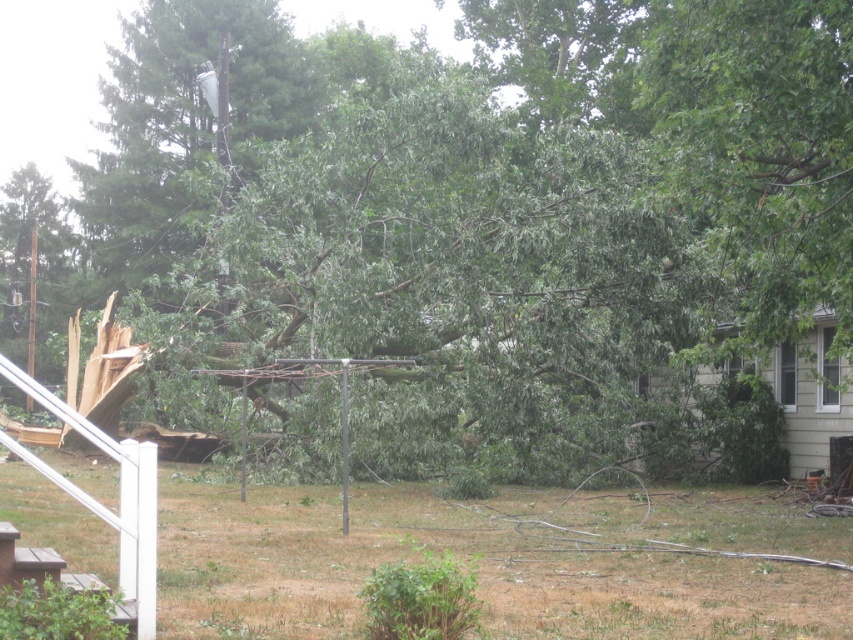
Does brown grass at lower center have a lesser width compared to green leafy tree at upper right?

Incorrect, brown grass at lower center's width is not less than green leafy tree at upper right's.

Who is more forward, (392, 529) or (851, 113)?

Positioned in front is point (851, 113).

Identify the location of brown grass at lower center. The image size is (853, 640). (500, 560).